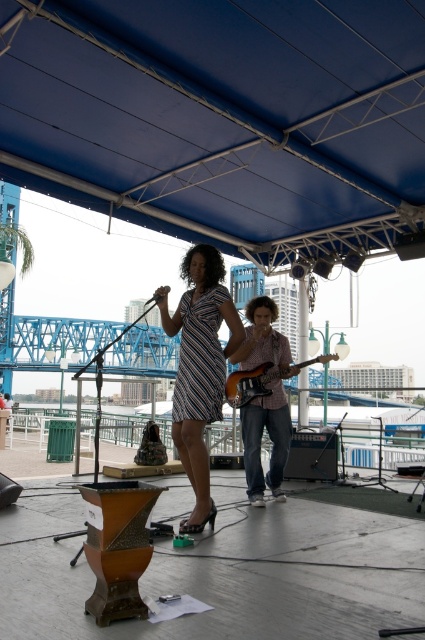
Question: Where is striped fabric dress at center located in relation to wooden electric guitar at center in the image?

Choices:
 (A) right
 (B) left

Answer: (B)

Question: Among these points, which one is nearest to the camera?

Choices:
 (A) (232, 372)
 (B) (178, 396)

Answer: (B)

Question: Which point is closer to the camera?

Choices:
 (A) wooden electric guitar at center
 (B) striped fabric dress at center

Answer: (B)

Question: Which of the following is the closest to the observer?

Choices:
 (A) (238, 394)
 (B) (204, 330)

Answer: (B)

Question: Is striped fabric dress at center further to the viewer compared to wooden electric guitar at center?

Choices:
 (A) yes
 (B) no

Answer: (B)

Question: Is striped fabric dress at center to the left of wooden electric guitar at center from the viewer's perspective?

Choices:
 (A) yes
 (B) no

Answer: (A)